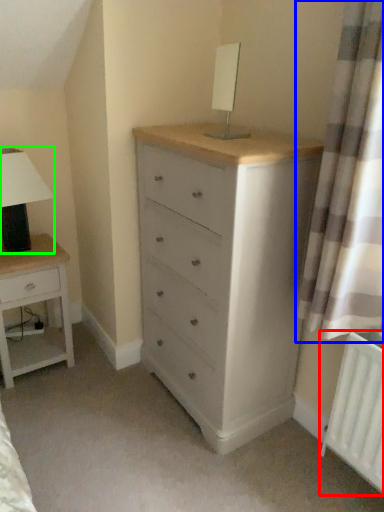
Question: Which object is positioned closest to radiator (highlighted by a red box)? Select from curtain (highlighted by a blue box) and table lamp (highlighted by a green box).

Choices:
 (A) curtain
 (B) table lamp

Answer: (A)